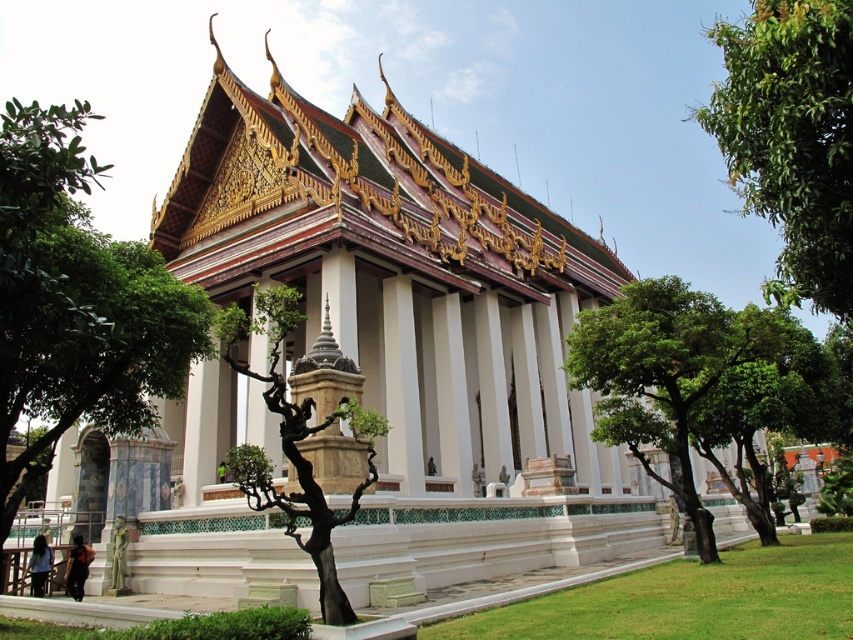
Question: Is green leafy tree at upper right bigger than green leafy tree at center?

Choices:
 (A) yes
 (B) no

Answer: (A)

Question: Which point is closer to the camera?

Choices:
 (A) black textured tree at center
 (B) green leafy tree at center

Answer: (A)

Question: Can you confirm if green leafy tree at center is bigger than black textured tree at center?

Choices:
 (A) no
 (B) yes

Answer: (B)

Question: Where is green leafy tree at center located in relation to black textured tree at center in the image?

Choices:
 (A) right
 (B) left

Answer: (A)

Question: Among these objects, which one is nearest to the camera?

Choices:
 (A) black textured tree at center
 (B) green leafy tree at upper right

Answer: (B)

Question: Which object is the farthest from the black textured tree at center?

Choices:
 (A) green leafy tree at center
 (B) green leafy tree at upper right

Answer: (B)